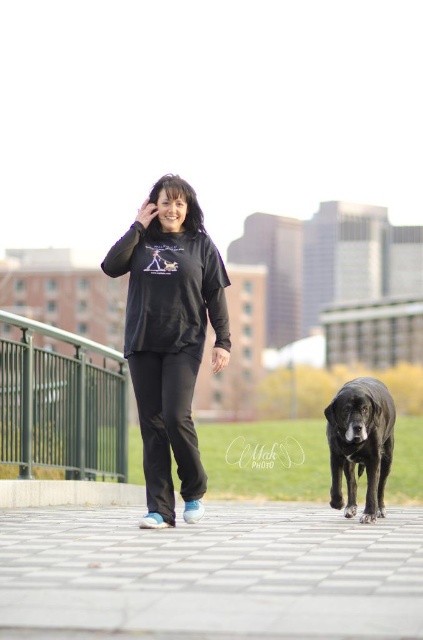
Question: Which object is closer to the camera taking this photo?

Choices:
 (A) paved stone pavement at lower center
 (B) shiny black fur at center
 (C) matte black hoodie at center
 (D) black matte sweatshirt at center

Answer: (A)

Question: Does paved stone pavement at lower center come behind matte black hoodie at center?

Choices:
 (A) no
 (B) yes

Answer: (A)

Question: Which of the following is the farthest from the observer?

Choices:
 (A) shiny black fur at center
 (B) matte black hoodie at center
 (C) black matte sweatshirt at center

Answer: (A)

Question: Is paved stone pavement at lower center positioned in front of matte black hoodie at center?

Choices:
 (A) yes
 (B) no

Answer: (A)

Question: Which object is farther from the camera taking this photo?

Choices:
 (A) paved stone pavement at lower center
 (B) matte black hoodie at center

Answer: (B)

Question: Can you confirm if paved stone pavement at lower center is positioned above shiny black fur at center?

Choices:
 (A) no
 (B) yes

Answer: (A)